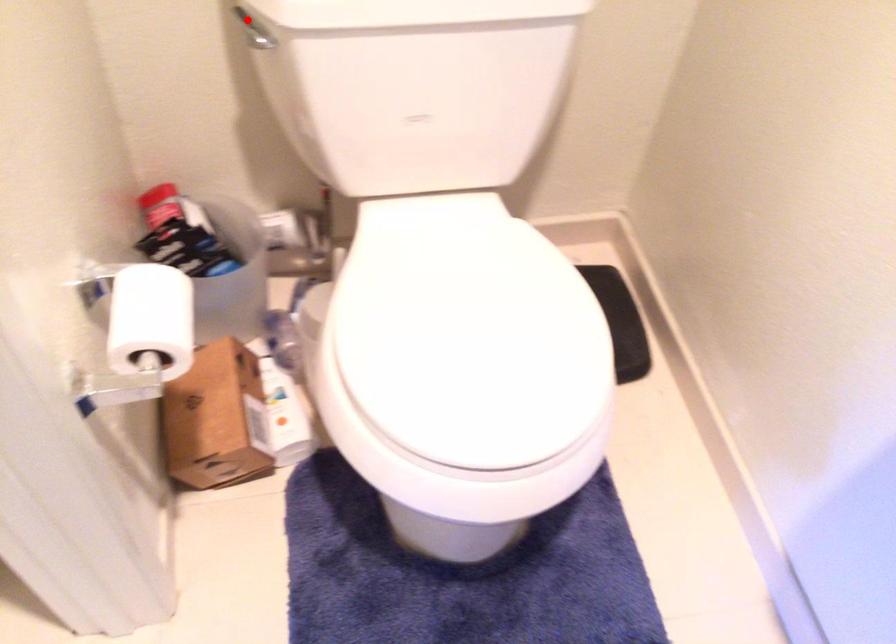
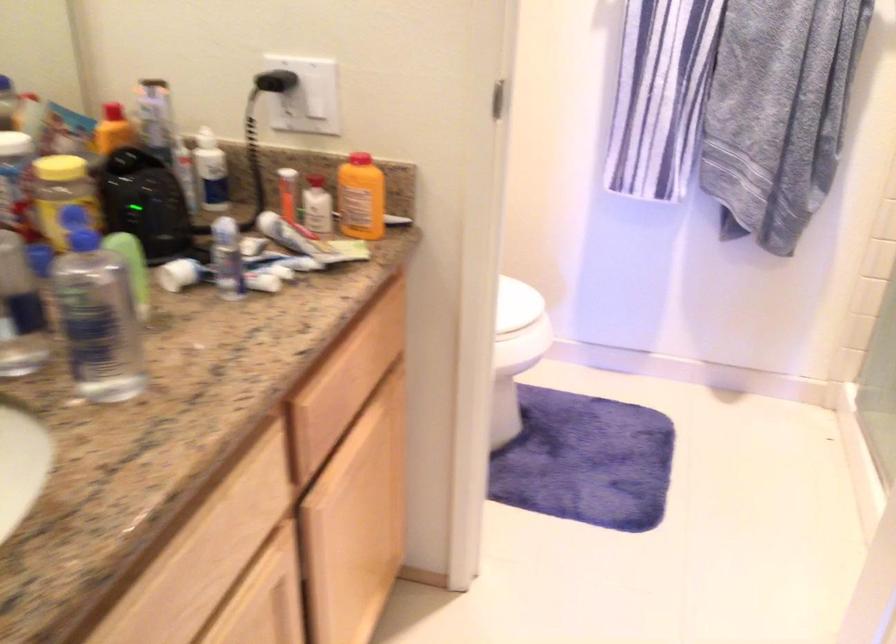
Question: I am providing you with two images of the same scene from different viewpoints. A red point is marked on the first image. Can you still see the location of the red point in image 2?

Choices:
 (A) Yes
 (B) No

Answer: (B)